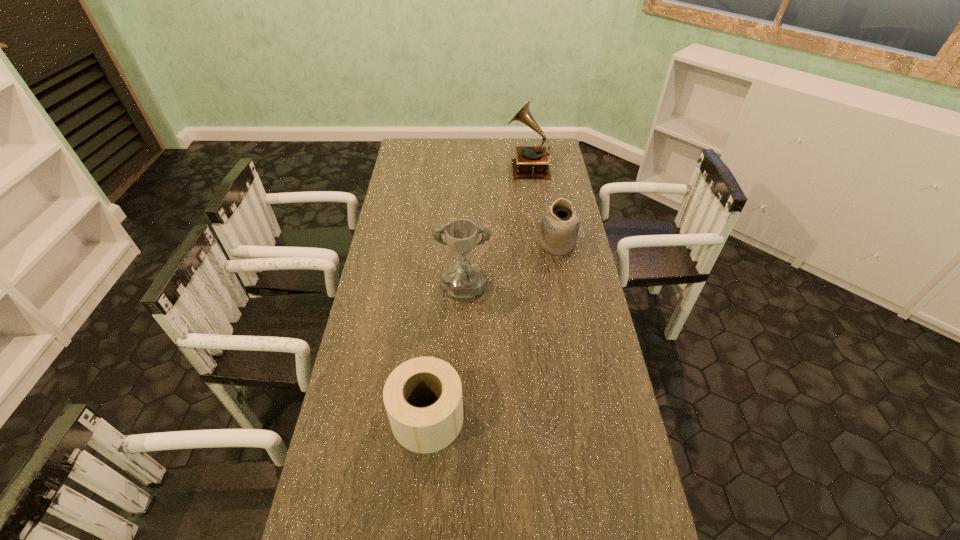
This screenshot has height=540, width=960. Identify the location of empty space that is in between the pottery and the second nearest object. (511, 268).

Choose which object is the second nearest neighbor to the nearest object. Please provide its 2D coordinates. Your answer should be formatted as a tuple, i.e. [(x, y)], where the tuple contains the x and y coordinates of a point satisfying the conditions above.

[(559, 229)]

Identify which object is located as the nearest to the nearest object. Please provide its 2D coordinates. Your answer should be formatted as a tuple, i.e. [(x, y)], where the tuple contains the x and y coordinates of a point satisfying the conditions above.

[(463, 281)]

Where is `vacant space that satisfies the following two spatial constraints: 1. on the horn of the record player; 2. on the side with emblem of the award`? The width and height of the screenshot is (960, 540). vacant space that satisfies the following two spatial constraints: 1. on the horn of the record player; 2. on the side with emblem of the award is located at coordinates (544, 292).

You are a GUI agent. You are given a task and a screenshot of the screen. Output one action in this format:
    pyautogui.click(x=<x>, y=<y>)
    Task: Click on the free space that satisfies the following two spatial constraints: 1. on the horn of the farthest object; 2. on the left side of the third nearest object
    
    Given the screenshot: What is the action you would take?
    pyautogui.click(x=538, y=245)

Where is `blank area in the image that satisfies the following two spatial constraints: 1. on the horn of the farthest object; 2. on the side with emblem of the award`? Image resolution: width=960 pixels, height=540 pixels. blank area in the image that satisfies the following two spatial constraints: 1. on the horn of the farthest object; 2. on the side with emblem of the award is located at coordinates (544, 292).

Locate an element on the screen. free region that satisfies the following two spatial constraints: 1. on the horn of the third nearest object; 2. on the left side of the farthest object is located at coordinates (538, 245).

Where is `vacant position in the image that satisfies the following two spatial constraints: 1. on the horn of the record player; 2. on the side with emblem of the award`? This screenshot has height=540, width=960. vacant position in the image that satisfies the following two spatial constraints: 1. on the horn of the record player; 2. on the side with emblem of the award is located at coordinates (544, 292).

Identify the location of blank space that satisfies the following two spatial constraints: 1. on the horn of the record player; 2. on the left side of the second farthest object. (538, 245).